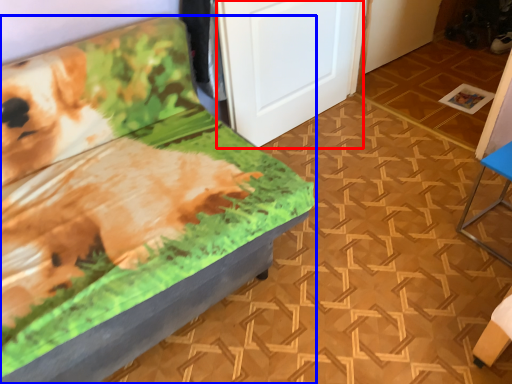
Question: Among these objects, which one is farthest to the camera, door (highlighted by a red box) or furniture (highlighted by a blue box)?

Choices:
 (A) door
 (B) furniture

Answer: (A)